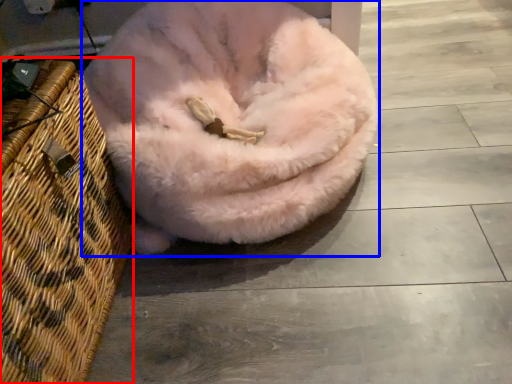
Question: Among these objects, which one is farthest to the camera, basket (highlighted by a red box) or dog bed (highlighted by a blue box)?

Choices:
 (A) basket
 (B) dog bed

Answer: (B)